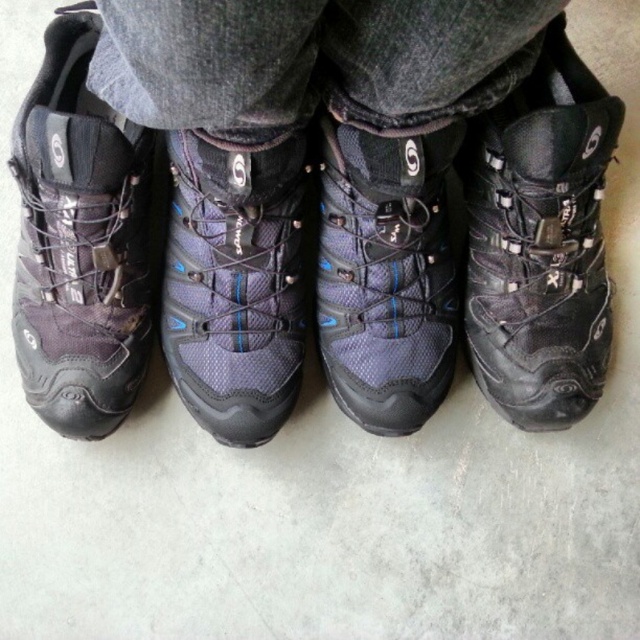
Question: Which of these objects is positioned farthest from the matte blue fabric hiking boot at center?

Choices:
 (A) matte black hiking boots at center
 (B) black leather boot at right
 (C) matte black hiking boot at left
 (D) matte blue mesh boot at center

Answer: (B)

Question: Considering the relative positions of matte black hiking boots at center and matte blue fabric hiking boot at center in the image provided, where is matte black hiking boots at center located with respect to matte blue fabric hiking boot at center?

Choices:
 (A) below
 (B) above

Answer: (B)

Question: Does matte black hiking boots at center appear under matte blue mesh boot at center?

Choices:
 (A) yes
 (B) no

Answer: (B)

Question: Which point is farther to the camera?

Choices:
 (A) (216, 396)
 (B) (77, 349)
 (C) (225, 3)

Answer: (A)

Question: Is matte black hiking boots at center bigger than matte blue mesh boot at center?

Choices:
 (A) no
 (B) yes

Answer: (B)

Question: Estimate the real-world distances between objects in this image. Which object is farther from the matte black hiking boots at center?

Choices:
 (A) matte black hiking boot at left
 (B) matte blue mesh boot at center
 (C) matte blue fabric hiking boot at center
 (D) black leather boot at right

Answer: (A)